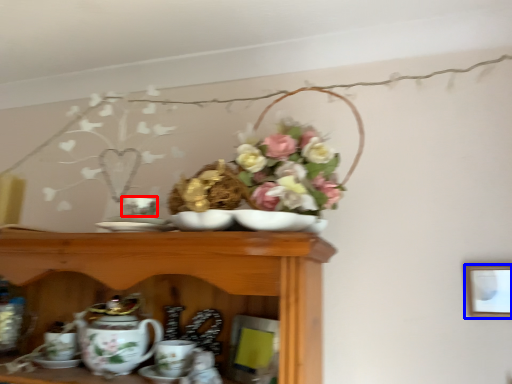
Question: Which of the following is the farthest to the observer, tableware (highlighted by a red box) or picture frame (highlighted by a blue box)?

Choices:
 (A) tableware
 (B) picture frame

Answer: (B)